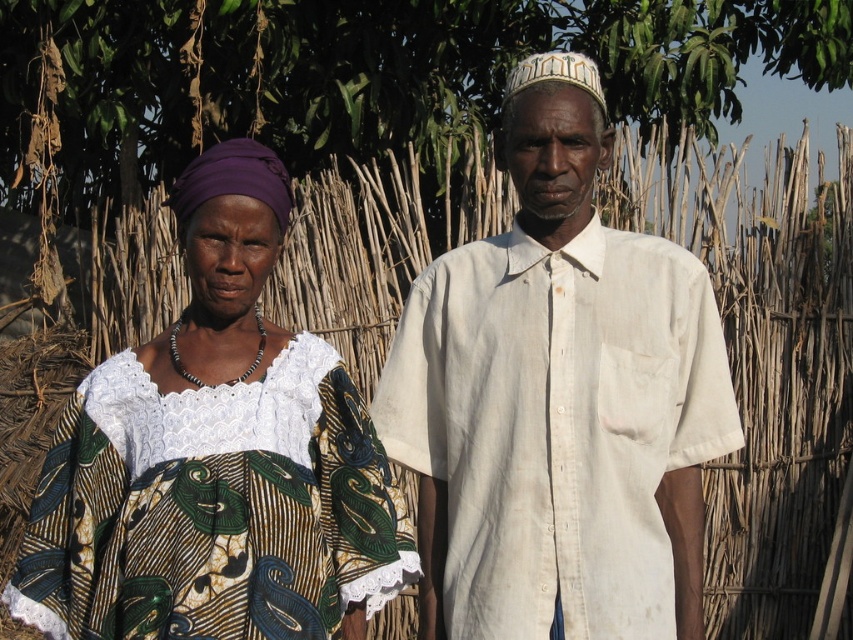
Question: Is white cotton shirt at center positioned in front of green leafy tree at upper center?

Choices:
 (A) no
 (B) yes

Answer: (B)

Question: Which of the following is the closest to the observer?

Choices:
 (A) green leafy tree at upper center
 (B) printed fabric dress at left

Answer: (B)

Question: Can you confirm if white cotton shirt at center is thinner than green leafy tree at upper center?

Choices:
 (A) yes
 (B) no

Answer: (A)

Question: From the image, what is the correct spatial relationship of white cotton shirt at center in relation to printed fabric dress at left?

Choices:
 (A) above
 (B) below

Answer: (A)

Question: Which object is positioned farthest from the white cotton shirt at center?

Choices:
 (A) printed fabric dress at left
 (B) green leafy tree at upper center

Answer: (B)

Question: Among these objects, which one is farthest from the camera?

Choices:
 (A) white cotton shirt at center
 (B) printed fabric dress at left

Answer: (A)